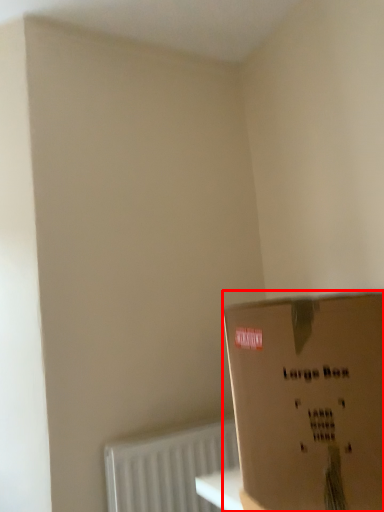
Question: From the image, what is the correct spatial relationship of box (annotated by the red box) in relation to radiator?

Choices:
 (A) right
 (B) left

Answer: (A)